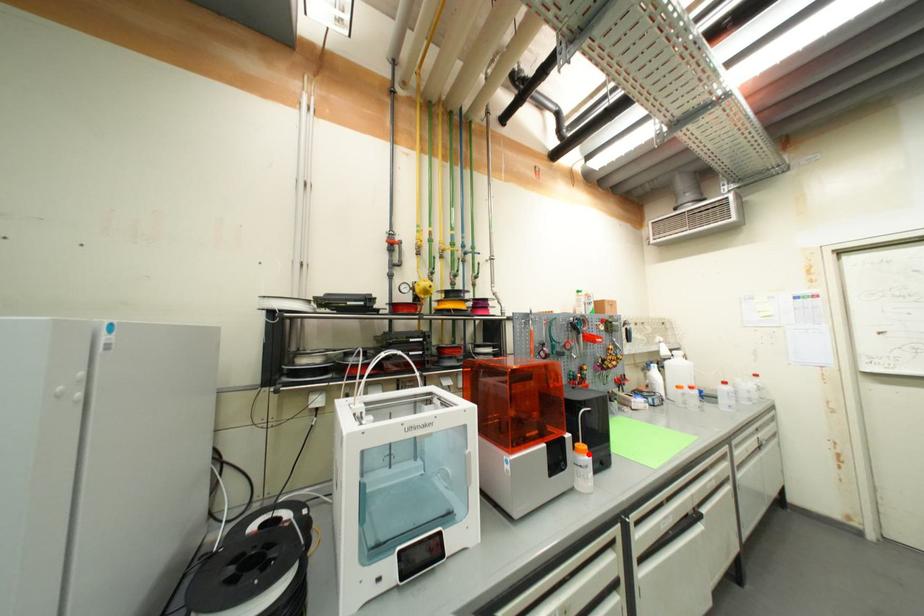
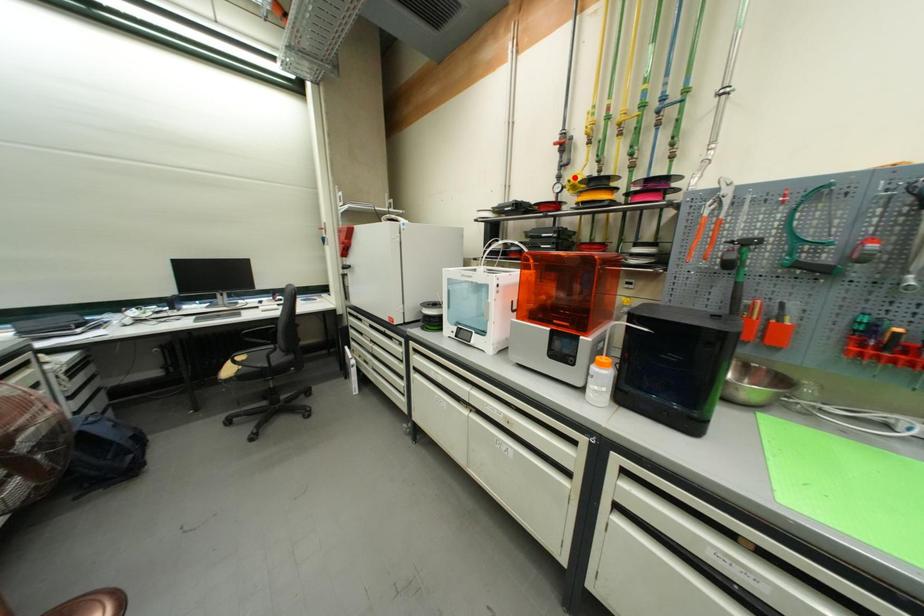
I am providing you with two images of the same scene from different viewpoints. A red point is marked on the first image and another point is marked on the second image. Is the red point in image1 aligned with the point shown in image2?

No